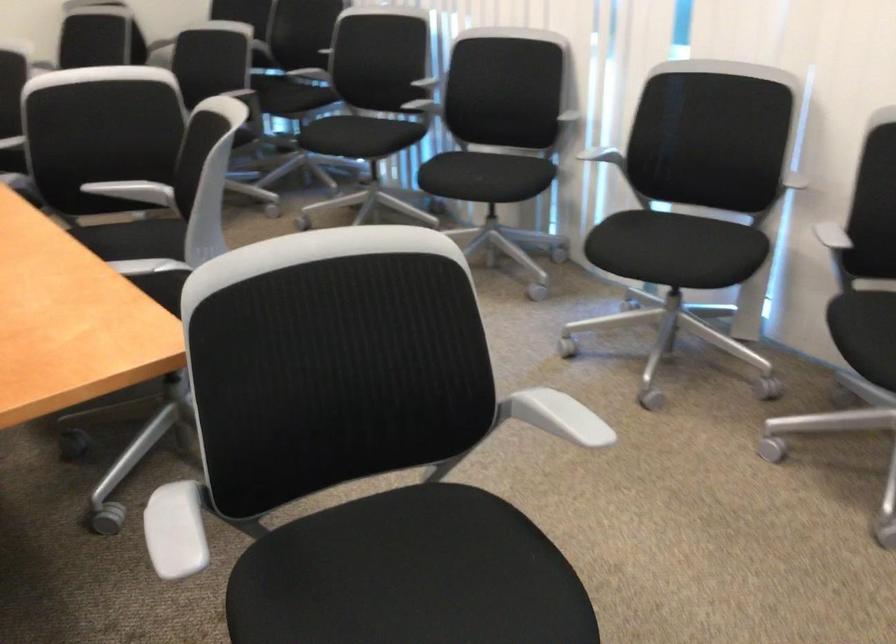
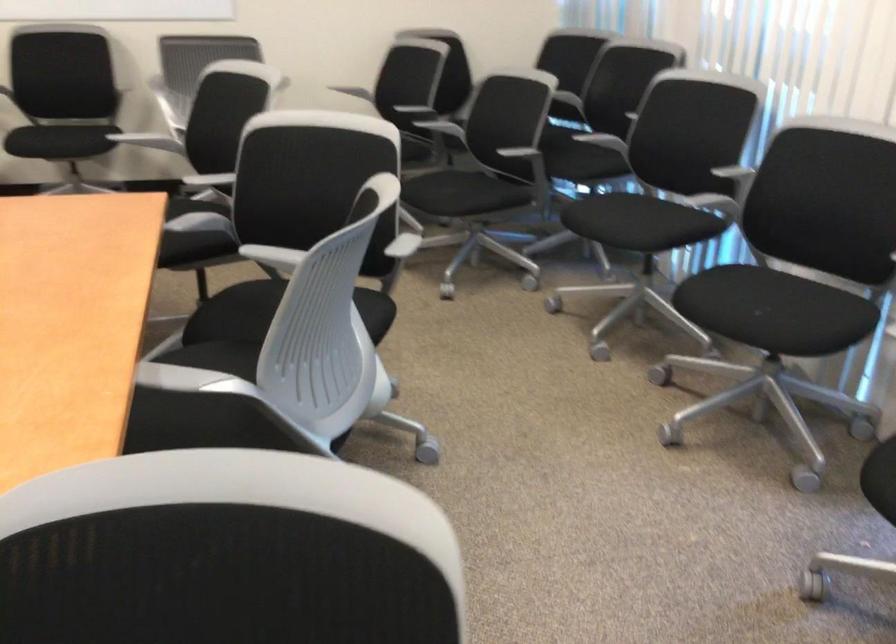
The point at (357, 138) is marked in the first image. Where is the corresponding point in the second image?

(624, 221)